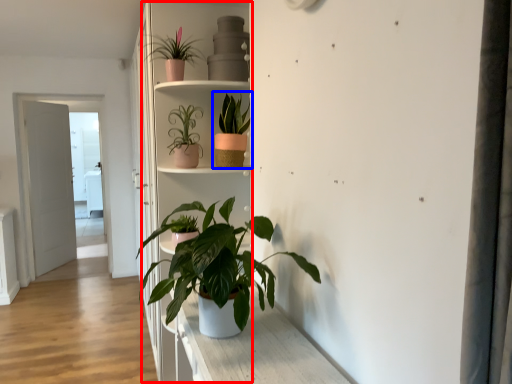
Question: Which point is further to the camera, bookshelf (highlighted by a red box) or houseplant (highlighted by a blue box)?

Choices:
 (A) bookshelf
 (B) houseplant

Answer: (A)